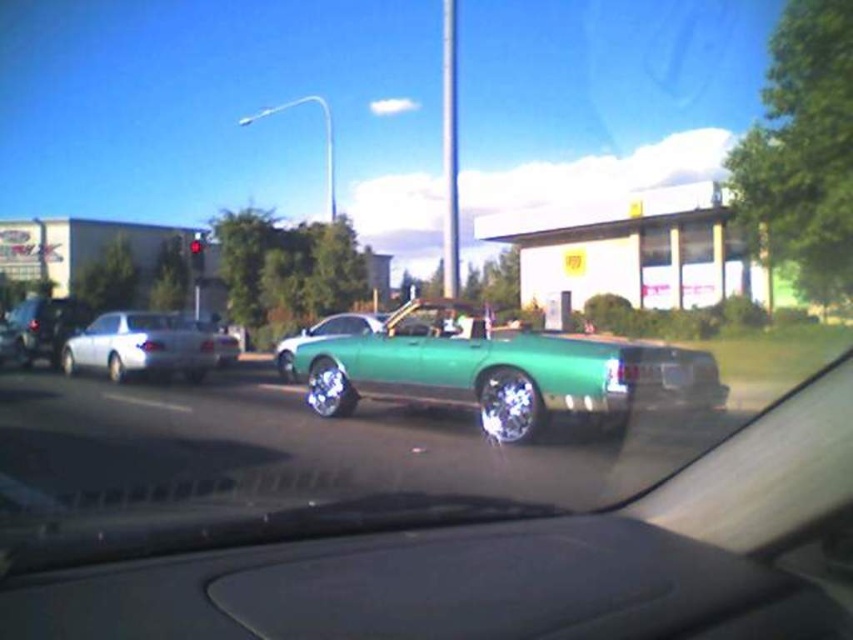
Question: Which point is farther to the camera?

Choices:
 (A) shiny green car at center
 (B) black matte dashboard at center
 (C) white glossy sedan at center

Answer: (C)

Question: Does black matte dashboard at center have a smaller size compared to shiny green car at center?

Choices:
 (A) no
 (B) yes

Answer: (B)

Question: Can you confirm if black matte dashboard at center is smaller than shiny green car at center?

Choices:
 (A) yes
 (B) no

Answer: (A)

Question: Which of the following is the closest to the observer?

Choices:
 (A) (286, 374)
 (B) (149, 332)

Answer: (B)

Question: Which of these objects is positioned closest to the white glossy sedan at center?

Choices:
 (A) black matte dashboard at center
 (B) shiny green car at center

Answer: (B)

Question: Does black matte dashboard at center have a larger size compared to shiny green car at center?

Choices:
 (A) no
 (B) yes

Answer: (A)